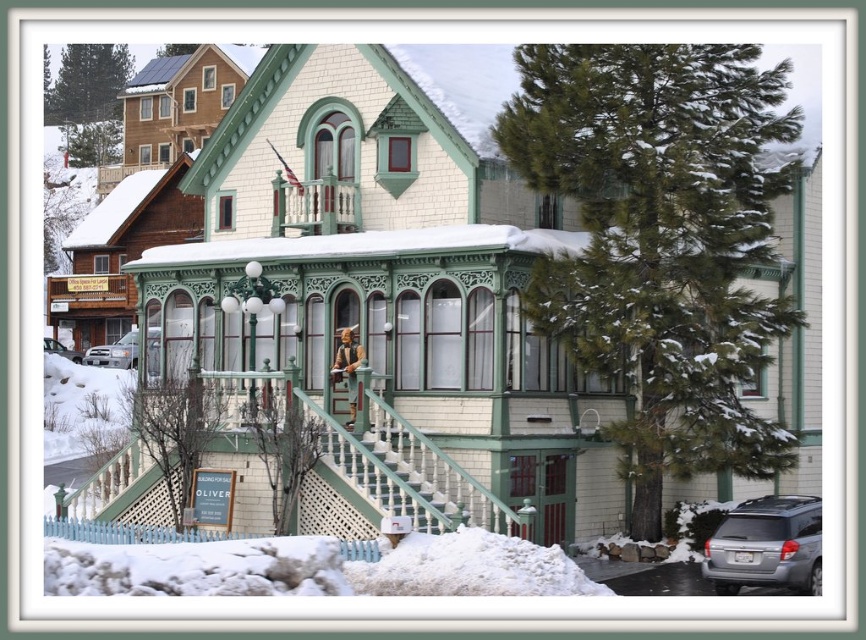
Is point (380, 504) positioned before point (134, 368)?

Yes, point (380, 504) is closer to viewer.

Is point (331, 465) positioned after point (131, 336)?

No, it is not.

Does point (509, 529) come farther from viewer compared to point (149, 332)?

No, (509, 529) is closer to viewer.

This screenshot has width=866, height=640. In order to click on white painted wood stairs at center in this screenshot , I will do `click(412, 472)`.

Does silver metallic sedan at lower left have a smaller size compared to silver metallic suv at lower left?

No, silver metallic sedan at lower left is not smaller than silver metallic suv at lower left.

Which is behind, point (105, 364) or point (44, 342)?

The point (44, 342) is more distant.

Where is `silver metallic sedan at lower left`? This screenshot has height=640, width=866. silver metallic sedan at lower left is located at coordinates (114, 353).

Between silver metallic suv at lower right and silver metallic suv at lower left, which one is positioned higher?

silver metallic suv at lower left is higher up.

Between point (721, 573) and point (62, 349), which one is positioned behind?

Point (62, 349)

Is point (764, 506) in front of point (76, 362)?

Yes.

Image resolution: width=866 pixels, height=640 pixels. Identify the location of silver metallic suv at lower right. (766, 545).